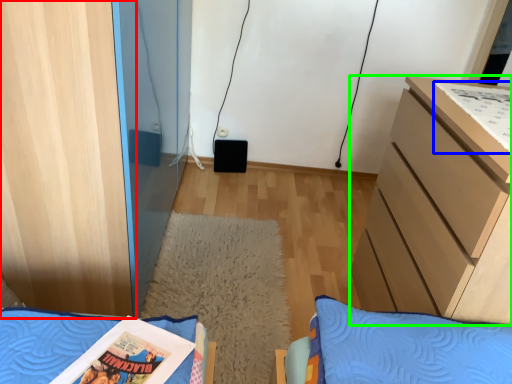
Question: Which is nearer to the cabinetry (highlighted by a red box)? comic book (highlighted by a blue box) or chest of drawers (highlighted by a green box).

Choices:
 (A) comic book
 (B) chest of drawers

Answer: (B)